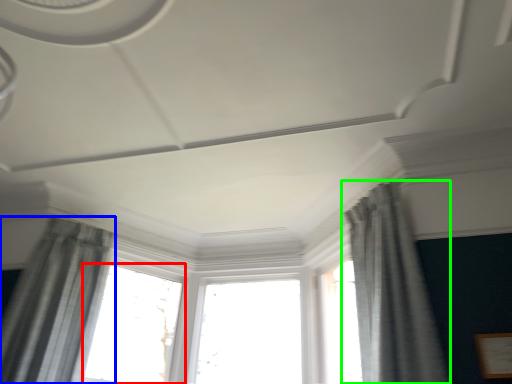
Question: Estimate the real-world distances between objects in this image. Which object is farther from window (highlighted by a red box), curtain (highlighted by a blue box) or curtain (highlighted by a green box)?

Choices:
 (A) curtain
 (B) curtain

Answer: (B)